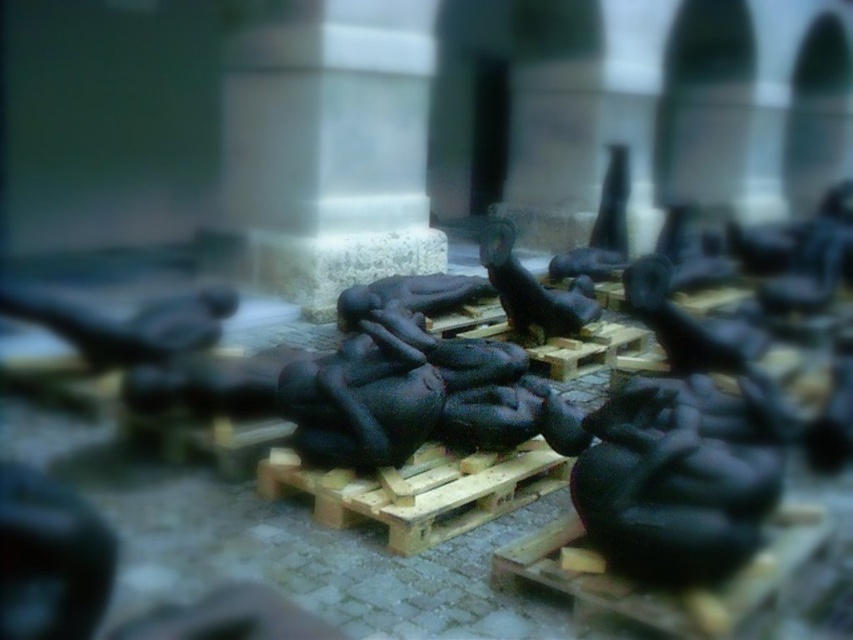
Question: Which point is closer to the camera taking this photo?

Choices:
 (A) [410, 4]
 (B) [506, 236]
 (C) [619, 230]

Answer: (B)

Question: Which of these objects is positioned farthest from the matte black sculpture at center?

Choices:
 (A) matte gray stone at center
 (B) black rubber sculpture at center

Answer: (A)

Question: In this image, where is matte gray stone at center located relative to black rubber sculpture at center?

Choices:
 (A) left
 (B) right

Answer: (A)

Question: Can you confirm if matte black sculpture at center is positioned to the right of black rubber sculpture at center?

Choices:
 (A) yes
 (B) no

Answer: (B)

Question: Which object is the farthest from the matte black sculpture at center?

Choices:
 (A) matte gray stone at center
 (B) black rubber sculpture at center

Answer: (A)

Question: Is matte black sculpture at center to the right of black rubber sculpture at center from the viewer's perspective?

Choices:
 (A) yes
 (B) no

Answer: (B)